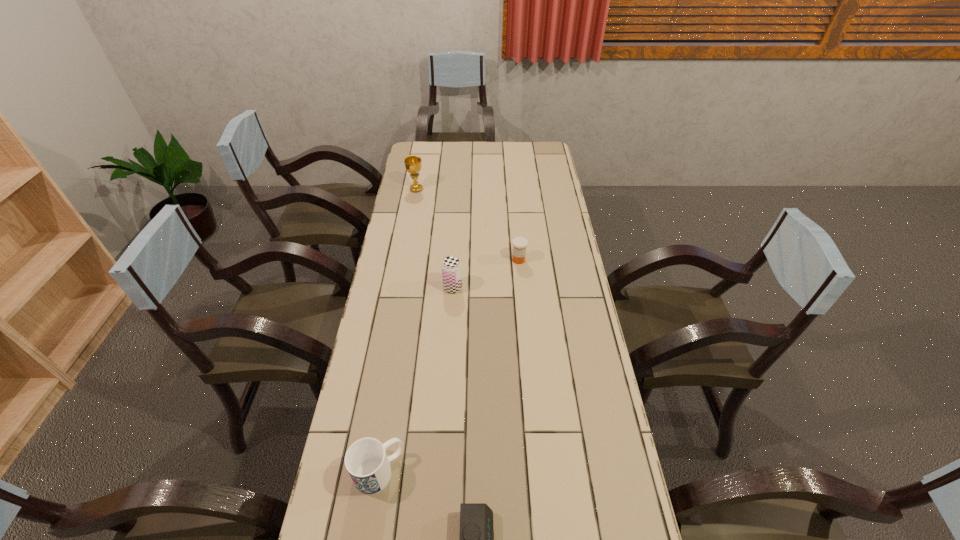
Find the location of a particular element. the tallest object is located at coordinates (413, 165).

You are a GUI agent. You are given a task and a screenshot of the screen. Output one action in this format:
    pyautogui.click(x=<x>, y=<y>)
    Task: Click on the farthest object
    Image resolution: width=960 pixels, height=540 pixels.
    Given the screenshot: What is the action you would take?
    pyautogui.click(x=413, y=165)

Locate an element on the screen. The image size is (960, 540). beer can is located at coordinates (451, 266).

The width and height of the screenshot is (960, 540). Identify the location of the third object from left to right. (451, 266).

What are the coordinates of `mug` in the screenshot? It's located at (366, 461).

You are a GUI agent. You are given a task and a screenshot of the screen. Output one action in this format:
    pyautogui.click(x=<x>, y=<y>)
    Task: Click on the third shortest object
    This screenshot has width=960, height=540.
    Given the screenshot: What is the action you would take?
    pyautogui.click(x=366, y=461)

The height and width of the screenshot is (540, 960). I want to click on the second shortest object, so click(519, 244).

I want to click on the rightmost object, so click(519, 244).

Locate an element on the screen. vacant area situated 0.220m on the back of the tallest object is located at coordinates (421, 160).

Find the location of a particular element. The width and height of the screenshot is (960, 540). vacant region located 0.210m on the left of the beer can is located at coordinates (385, 288).